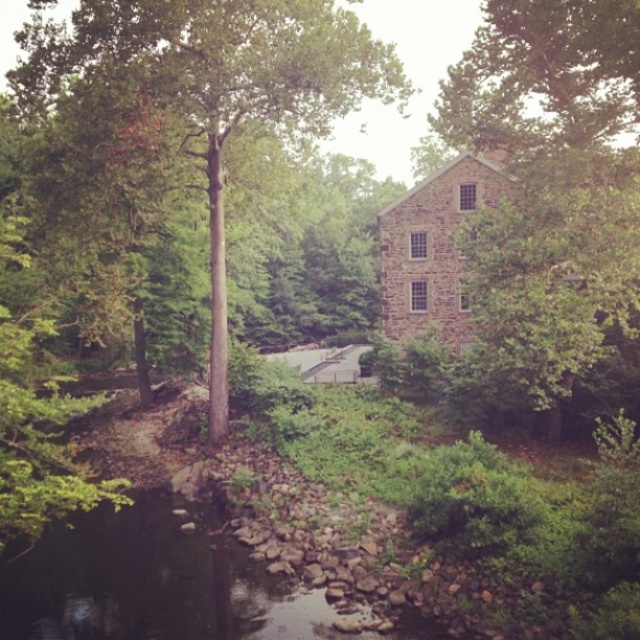
Does green leafy tree at upper right have a greater width compared to green rough bark tree at center?

In fact, green leafy tree at upper right might be narrower than green rough bark tree at center.

Does green leafy tree at upper right appear under green rough bark tree at center?

Correct, green leafy tree at upper right is located below green rough bark tree at center.

Where is `green leafy tree at upper right`? This screenshot has height=640, width=640. green leafy tree at upper right is located at coordinates (561, 125).